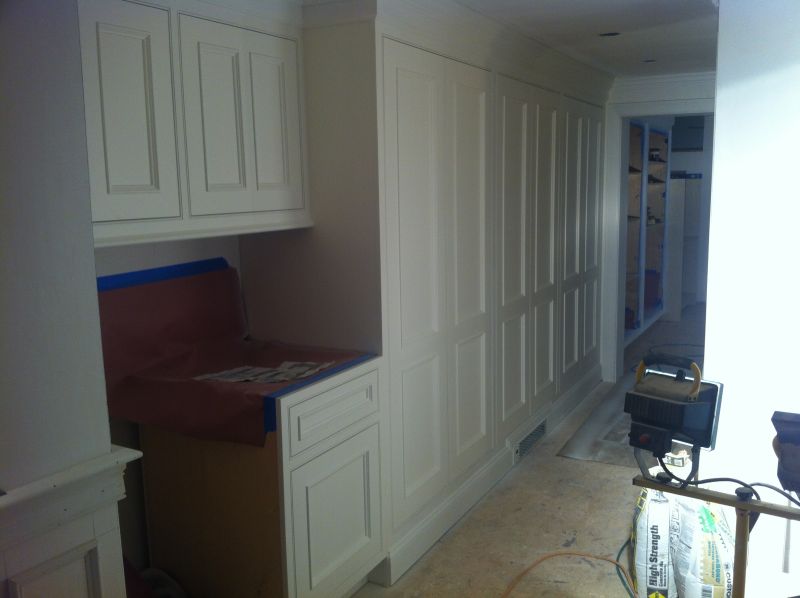
Find the location of `glass`. glass is located at coordinates (654, 202), (633, 222).